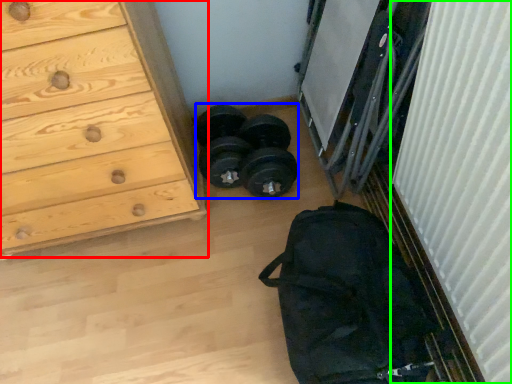
Question: Based on their relative distances, which object is nearer to chest of drawers (highlighted by a red box)? Choose from reel (highlighted by a blue box) and curtain (highlighted by a green box).

Choices:
 (A) reel
 (B) curtain

Answer: (A)